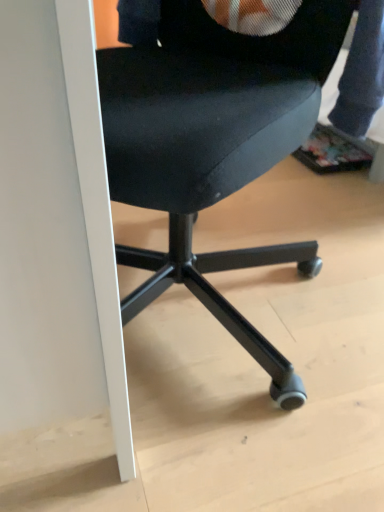
Where is `vacant location behind black leather chair at center`? The height and width of the screenshot is (512, 384). vacant location behind black leather chair at center is located at coordinates (266, 205).